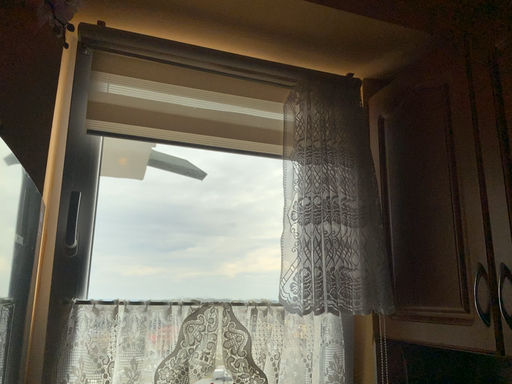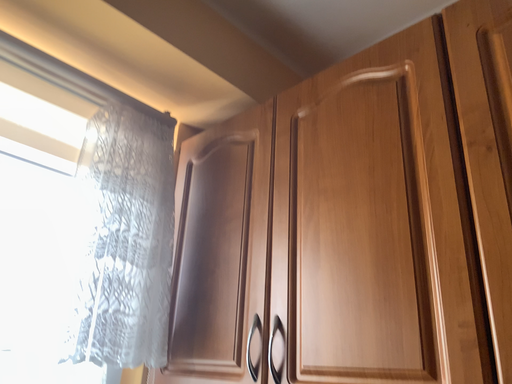
Question: How did the camera likely rotate when shooting the video?

Choices:
 (A) rotated left
 (B) rotated right

Answer: (B)